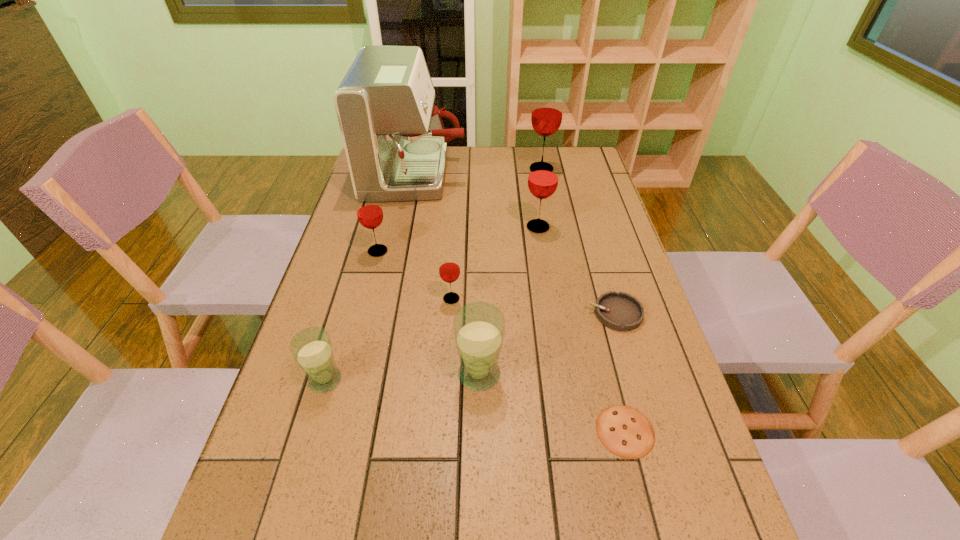
Where is `cookie that is at the right edge`? This screenshot has width=960, height=540. cookie that is at the right edge is located at coordinates (623, 430).

The width and height of the screenshot is (960, 540). Identify the location of object that is at the far left corner. (395, 142).

Find the location of a particular element. object that is positioned at the far right corner is located at coordinates coord(547,112).

This screenshot has width=960, height=540. In the image, there is a desktop. What are the coordinates of `free region at the far edge` in the screenshot? It's located at (466, 168).

You are a GUI agent. You are given a task and a screenshot of the screen. Output one action in this format:
    pyautogui.click(x=<x>, y=<y>)
    Task: Click on the free space at the left edge
    The width and height of the screenshot is (960, 540).
    Given the screenshot: What is the action you would take?
    pyautogui.click(x=307, y=433)

The width and height of the screenshot is (960, 540). In order to click on free spot at the right edge of the desktop in this screenshot , I will do `click(616, 272)`.

This screenshot has width=960, height=540. In order to click on blank space at the far right corner of the desktop in this screenshot , I will do `click(574, 151)`.

Locate an element on the screen. unoccupied position between the fifth nearest glass and the smaller blue glass is located at coordinates (432, 303).

In order to click on vacant area that lies between the smallest red glass and the third tallest object in this screenshot , I will do `click(494, 263)`.

Where is `vacant space that's between the nearest red glass and the biggest red glass`? This screenshot has height=540, width=960. vacant space that's between the nearest red glass and the biggest red glass is located at coordinates (496, 234).